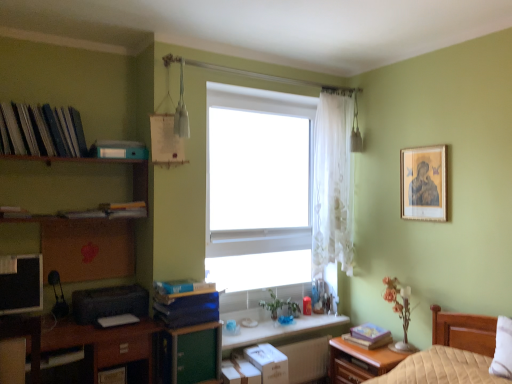
Question: Is wooden nightstand at lower right facing towards black plastic printer at lower left?

Choices:
 (A) yes
 (B) no

Answer: (A)

Question: Is wooden nightstand at lower right in contact with black plastic printer at lower left?

Choices:
 (A) yes
 (B) no

Answer: (B)

Question: Is wooden nightstand at lower right wider than black plastic printer at lower left?

Choices:
 (A) no
 (B) yes

Answer: (A)

Question: From a real-world perspective, does wooden nightstand at lower right stand above black plastic printer at lower left?

Choices:
 (A) no
 (B) yes

Answer: (A)

Question: Considering the relative sizes of wooden nightstand at lower right and black plastic printer at lower left in the image provided, is wooden nightstand at lower right thinner than black plastic printer at lower left?

Choices:
 (A) yes
 (B) no

Answer: (A)

Question: Is brown wooden shelf at upper left bigger or smaller than matte blue bookshelf at upper left, the fourth book from the right?

Choices:
 (A) big
 (B) small

Answer: (A)

Question: Visually, is brown wooden shelf at upper left positioned to the left or to the right of matte blue bookshelf at upper left, acting as the 2th book starting from the top?

Choices:
 (A) left
 (B) right

Answer: (A)

Question: In terms of height, does brown wooden shelf at upper left look taller or shorter compared to matte blue bookshelf at upper left, acting as the 2th book starting from the top?

Choices:
 (A) tall
 (B) short

Answer: (A)

Question: From a real-world perspective, relative to matte blue bookshelf at upper left, the fourth book from the bottom, is brown wooden shelf at upper left vertically above or below?

Choices:
 (A) above
 (B) below

Answer: (B)

Question: From the image's perspective, is white sheer curtain at center above or below blue matte book at lower left, the fourth book from the top?

Choices:
 (A) above
 (B) below

Answer: (A)

Question: Looking at the image, does white sheer curtain at center seem bigger or smaller compared to blue matte book at lower left, the 3th book when ordered from left to right?

Choices:
 (A) big
 (B) small

Answer: (A)

Question: Considering the positions of point (322, 213) and point (185, 316), is point (322, 213) closer or farther from the camera than point (185, 316)?

Choices:
 (A) closer
 (B) farther

Answer: (B)

Question: In the image, is white sheer curtain at center positioned in front of or behind blue matte book at lower left, placed as the 3th book when sorted from right to left?

Choices:
 (A) behind
 (B) front

Answer: (A)

Question: Do you think blue matte book at lower left, which is the 4th book from left to right, is within hardcover book at center, marked as the 5th book in a left-to-right arrangement, or outside of it?

Choices:
 (A) inside
 (B) outside

Answer: (B)

Question: In the image, is blue matte book at lower left, which appears as the second book when viewed from the right, positioned in front of or behind hardcover book at center, which is the first book in right-to-left order?

Choices:
 (A) front
 (B) behind

Answer: (A)